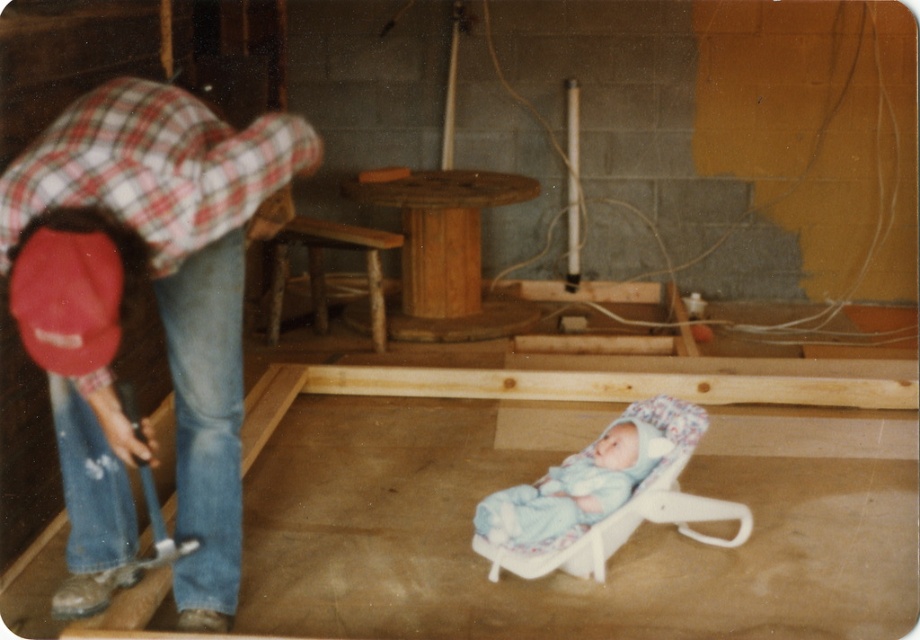
Which is below, red plaid shirt at left or wooden rustic chair at center?

red plaid shirt at left is below.

What do you see at coordinates (158, 308) in the screenshot? I see `red plaid shirt at left` at bounding box center [158, 308].

Where is `red plaid shirt at left`? The image size is (920, 640). red plaid shirt at left is located at coordinates coord(158,308).

Who is positioned more to the right, red plaid shirt at left or blue soft fabric newborn at center?

Positioned to the right is blue soft fabric newborn at center.

Describe the element at coordinates (158, 308) in the screenshot. This screenshot has width=920, height=640. I see `red plaid shirt at left` at that location.

Locate an element on the screen. red plaid shirt at left is located at coordinates (158, 308).

Does white fabric baby carriage at center appear over blue soft fabric newborn at center?

Incorrect, white fabric baby carriage at center is not positioned above blue soft fabric newborn at center.

Locate an element on the screen. white fabric baby carriage at center is located at coordinates (631, 502).

Does point (673, 504) come closer to viewer compared to point (567, 509)?

No, (673, 504) is further to viewer.

The image size is (920, 640). In order to click on white fabric baby carriage at center in this screenshot , I will do `click(631, 502)`.